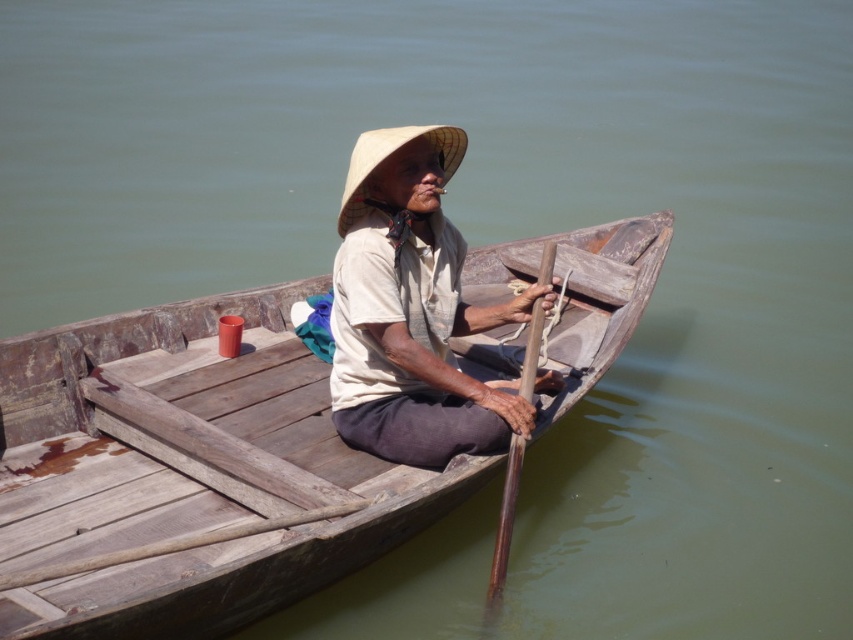
Can you confirm if white cotton shirt at center is taller than brown wooden paddle at center?

Correct, white cotton shirt at center is much taller as brown wooden paddle at center.

Is white cotton shirt at center wider than brown wooden paddle at center?

Correct, the width of white cotton shirt at center exceeds that of brown wooden paddle at center.

Which is behind, point (376, 390) or point (508, 456)?

The point (376, 390) is more distant.

Locate an element on the screen. white cotton shirt at center is located at coordinates (412, 310).

Measure the distance between point (376,524) and camera.

Point (376,524) and camera are 6.10 meters apart.

Can you confirm if wooden boat at center is smaller than straw hat at center?

Incorrect, wooden boat at center is not smaller in size than straw hat at center.

Which is in front, point (247, 490) or point (366, 156)?

Point (366, 156) is more forward.

Locate an element on the screen. wooden boat at center is located at coordinates (186, 472).

Does wooden boat at center come in front of white cotton shirt at center?

Yes, it is.

From the picture: Which of these two, wooden boat at center or white cotton shirt at center, stands shorter?

With less height is wooden boat at center.

Does point (637, 244) lie in front of point (386, 433)?

No, it is behind (386, 433).

Find the location of a particular element. Image resolution: width=853 pixels, height=640 pixels. wooden boat at center is located at coordinates (186, 472).